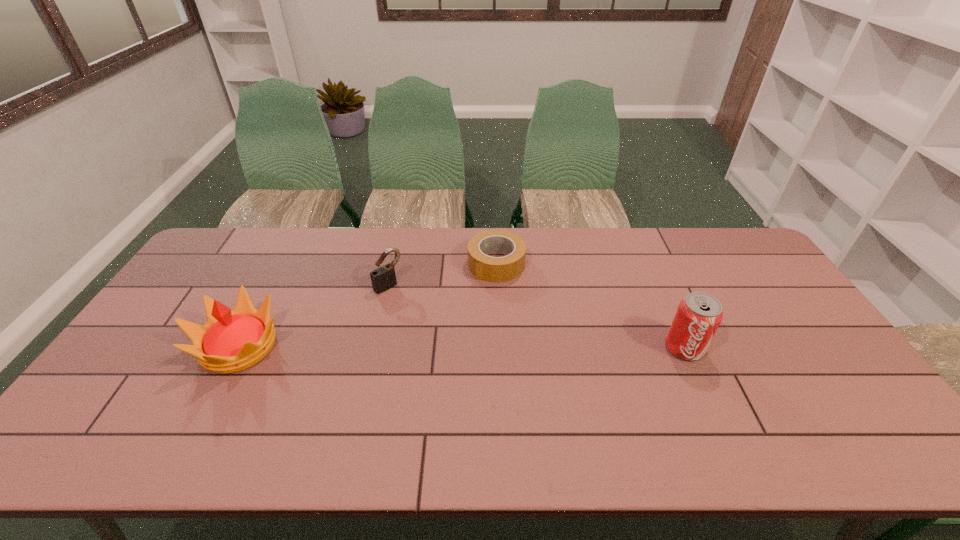
Where is `free point located with the keyhole on the front of the padlock`? The height and width of the screenshot is (540, 960). free point located with the keyhole on the front of the padlock is located at coordinates (443, 336).

You are a GUI agent. You are given a task and a screenshot of the screen. Output one action in this format:
    pyautogui.click(x=<x>, y=<y>)
    Task: Click on the free space located at the edge of the shortest object
    This screenshot has width=960, height=540.
    Given the screenshot: What is the action you would take?
    pyautogui.click(x=465, y=293)

You are a GUI agent. You are given a task and a screenshot of the screen. Output one action in this format:
    pyautogui.click(x=<x>, y=<y>)
    Task: Click on the blank space located at the edge of the shortest object
    This screenshot has height=540, width=960.
    Given the screenshot: What is the action you would take?
    (x=409, y=344)

Find the location of a particular element. This screenshot has width=960, height=540. free space located at the edge of the shortest object is located at coordinates (434, 321).

Where is `object at the far edge`? The image size is (960, 540). object at the far edge is located at coordinates coord(493,269).

The width and height of the screenshot is (960, 540). I want to click on vacant space at the far edge of the desktop, so click(658, 246).

In the image, there is a desktop. At what (x,y) coordinates should I click in order to perform the action: click on vacant region at the near edge. Please return your answer as a coordinate pair (x, y). The height and width of the screenshot is (540, 960). Looking at the image, I should click on (157, 404).

What are the coordinates of `vacant space at the left edge of the desktop` in the screenshot? It's located at (146, 377).

In the image, there is a desktop. Identify the location of free space at the right edge. This screenshot has width=960, height=540. (797, 386).

This screenshot has height=540, width=960. What are the coordinates of `vacant position at the far left corner of the desktop` in the screenshot? It's located at (237, 234).